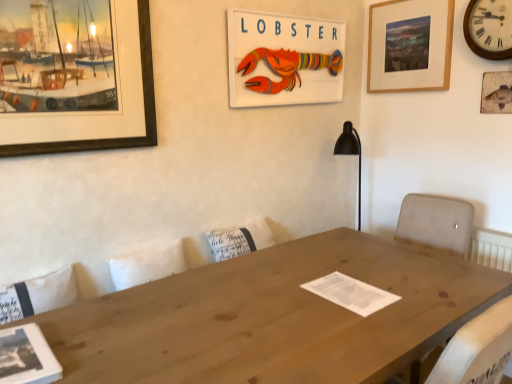
Question: Is wooden picture frame at upper right, marked as the third picture frame in a left-to-right arrangement, not close to wooden clock at upper right?

Choices:
 (A) no
 (B) yes

Answer: (A)

Question: Is wooden picture frame at upper right, placed as the second picture frame when sorted from right to left, positioned with its back to wooden clock at upper right?

Choices:
 (A) yes
 (B) no

Answer: (B)

Question: Is wooden picture frame at upper right, placed as the second picture frame when sorted from right to left, completely or partially outside of wooden clock at upper right?

Choices:
 (A) yes
 (B) no

Answer: (A)

Question: From the image's perspective, would you say wooden picture frame at upper right, marked as the third picture frame in a left-to-right arrangement, is positioned over wooden clock at upper right?

Choices:
 (A) yes
 (B) no

Answer: (A)

Question: Can you confirm if wooden picture frame at upper right, marked as the third picture frame in a left-to-right arrangement, is thinner than wooden clock at upper right?

Choices:
 (A) no
 (B) yes

Answer: (B)

Question: In the image, is wooden clock at upper right positioned in front of or behind natural wood table at center?

Choices:
 (A) front
 (B) behind

Answer: (B)

Question: From a real-world perspective, is wooden clock at upper right above or below natural wood table at center?

Choices:
 (A) above
 (B) below

Answer: (A)

Question: Is wooden clock at upper right inside or outside of natural wood table at center?

Choices:
 (A) inside
 (B) outside

Answer: (B)

Question: From the image's perspective, is wooden clock at upper right above or below natural wood table at center?

Choices:
 (A) above
 (B) below

Answer: (A)

Question: From the image's perspective, is wooden picture frame at upper right, placed as the second picture frame when sorted from right to left, located above or below wooden picture frame at upper right, which is counted as the first picture frame, starting from the right?

Choices:
 (A) above
 (B) below

Answer: (A)

Question: Do you think wooden picture frame at upper right, marked as the third picture frame in a left-to-right arrangement, is within wooden picture frame at upper right, the fourth picture frame in the left-to-right sequence, or outside of it?

Choices:
 (A) inside
 (B) outside

Answer: (B)

Question: From a real-world perspective, relative to wooden picture frame at upper right, the fourth picture frame in the left-to-right sequence, is wooden picture frame at upper right, marked as the third picture frame in a left-to-right arrangement, vertically above or below?

Choices:
 (A) below
 (B) above

Answer: (B)

Question: Considering the positions of wooden picture frame at upper right, marked as the third picture frame in a left-to-right arrangement, and wooden picture frame at upper right, which is counted as the first picture frame, starting from the right, in the image, is wooden picture frame at upper right, marked as the third picture frame in a left-to-right arrangement, wider or thinner than wooden picture frame at upper right, which is counted as the first picture frame, starting from the right,?

Choices:
 (A) thin
 (B) wide

Answer: (B)

Question: From a real-world perspective, is wooden lobster sign at upper center, acting as the 2th picture frame starting from the left, above or below natural wood table at center?

Choices:
 (A) below
 (B) above

Answer: (B)

Question: Relative to natural wood table at center, is wooden lobster sign at upper center, acting as the 2th picture frame starting from the left, in front or behind?

Choices:
 (A) behind
 (B) front

Answer: (A)